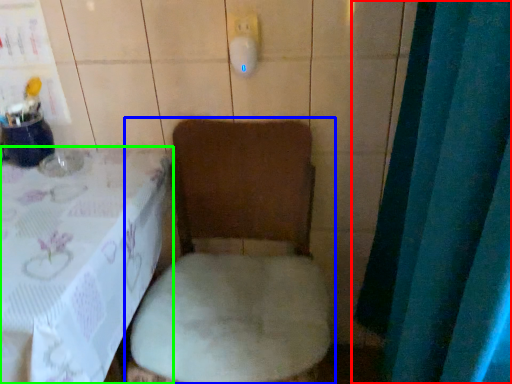
Question: Based on their relative distances, which object is farther from curtain (highlighted by a red box)? Choose from toilet (highlighted by a blue box) and furniture (highlighted by a green box).

Choices:
 (A) toilet
 (B) furniture

Answer: (B)